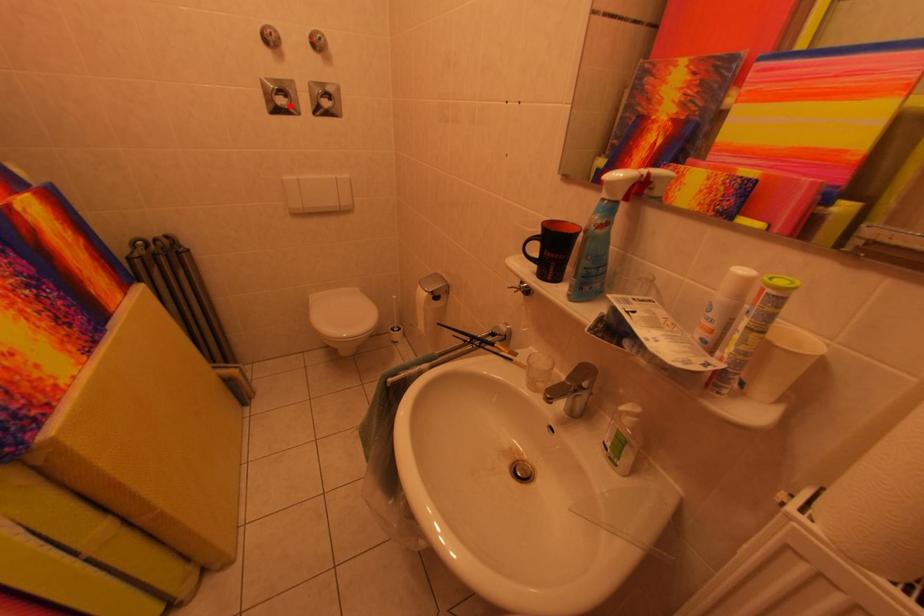
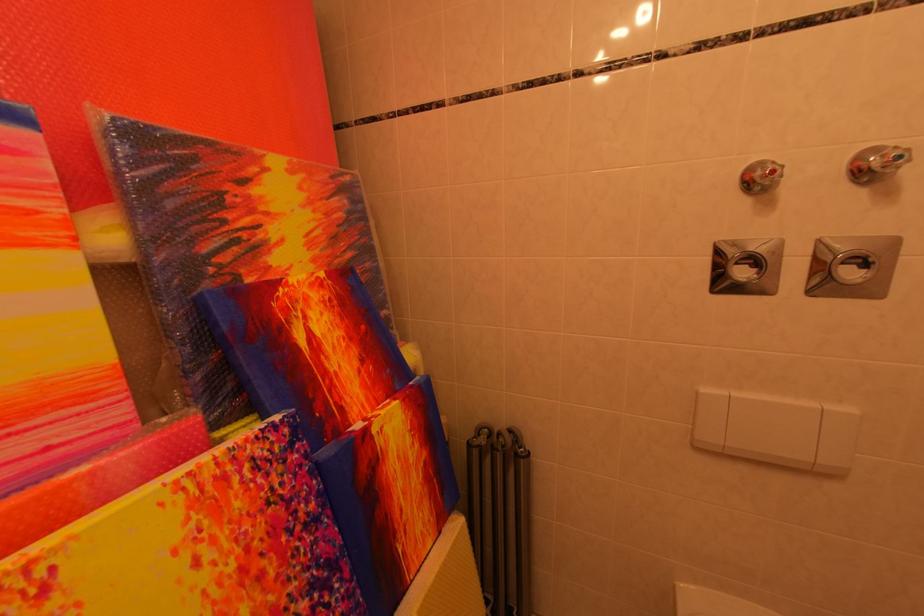
Locate, in the second image, the point that corresponds to the highlighted location in the first image.

(751, 277)